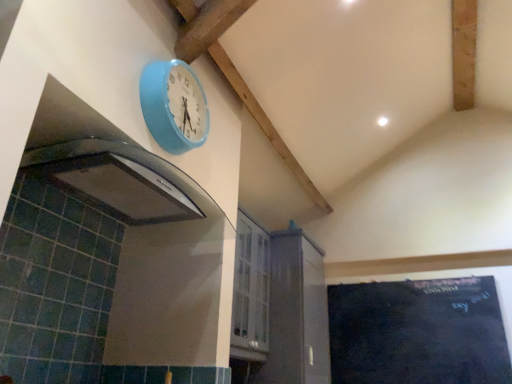
Question: Considering the relative sizes of black chalkboard at lower right and light blue plastic clock at upper center in the image provided, is black chalkboard at lower right bigger than light blue plastic clock at upper center?

Choices:
 (A) no
 (B) yes

Answer: (B)

Question: Can you confirm if black chalkboard at lower right is taller than light blue plastic clock at upper center?

Choices:
 (A) yes
 (B) no

Answer: (A)

Question: Is light blue plastic clock at upper center at the back of black chalkboard at lower right?

Choices:
 (A) yes
 (B) no

Answer: (B)

Question: Considering the relative sizes of black chalkboard at lower right and light blue plastic clock at upper center in the image provided, is black chalkboard at lower right thinner than light blue plastic clock at upper center?

Choices:
 (A) yes
 (B) no

Answer: (A)

Question: From the image's perspective, is black chalkboard at lower right over light blue plastic clock at upper center?

Choices:
 (A) yes
 (B) no

Answer: (B)

Question: Do you think black chalkboard at lower right is within white glossy cabinet at center, or outside of it?

Choices:
 (A) inside
 (B) outside

Answer: (B)

Question: Visually, is black chalkboard at lower right positioned to the left or to the right of white glossy cabinet at center?

Choices:
 (A) left
 (B) right

Answer: (B)

Question: From the image's perspective, is black chalkboard at lower right above or below white glossy cabinet at center?

Choices:
 (A) above
 (B) below

Answer: (B)

Question: Considering the positions of point (434, 375) and point (296, 322), is point (434, 375) closer or farther from the camera than point (296, 322)?

Choices:
 (A) farther
 (B) closer

Answer: (A)

Question: Is point (174, 87) closer or farther from the camera than point (266, 382)?

Choices:
 (A) farther
 (B) closer

Answer: (B)

Question: From their relative heights in the image, would you say light blue plastic clock at upper center is taller or shorter than white glossy cabinet at center?

Choices:
 (A) tall
 (B) short

Answer: (B)

Question: In terms of width, does light blue plastic clock at upper center look wider or thinner when compared to white glossy cabinet at center?

Choices:
 (A) wide
 (B) thin

Answer: (B)

Question: From the image's perspective, is light blue plastic clock at upper center positioned above or below white glossy cabinet at center?

Choices:
 (A) above
 (B) below

Answer: (A)

Question: Is point (300, 367) closer or farther from the camera than point (496, 372)?

Choices:
 (A) farther
 (B) closer

Answer: (B)

Question: From the image's perspective, is white glossy cabinet at center located above or below black chalkboard at lower right?

Choices:
 (A) above
 (B) below

Answer: (A)